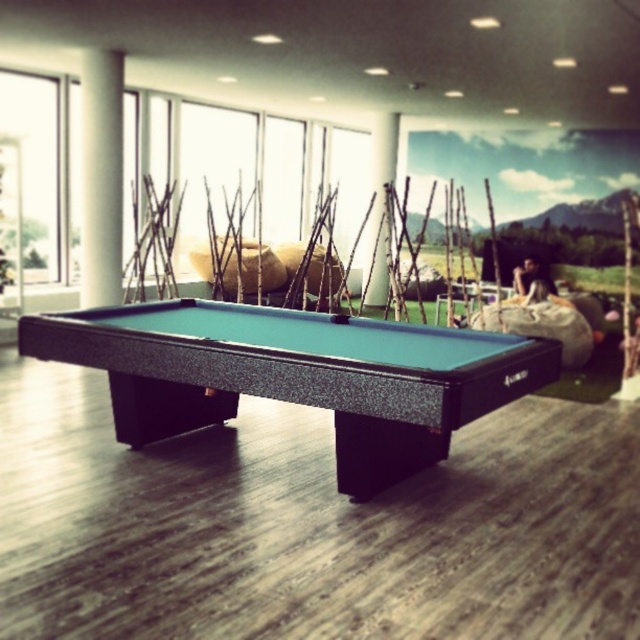
You are a guest at a party and want to take a photo of the transparent glass window at upper left through the green felt pool table at center. Is this possible?

The green felt pool table at center is in front of the transparent glass window at upper left, so you cannot take a photo of the window through the pool table because it is blocking the view.

You are standing in the room and want to see the view outside the transparent glass window at upper left. Is the white glossy column at upper left blocking your view of the window?

The white glossy column at upper left is in front of the transparent glass window at upper left, so it is blocking your view of the window.